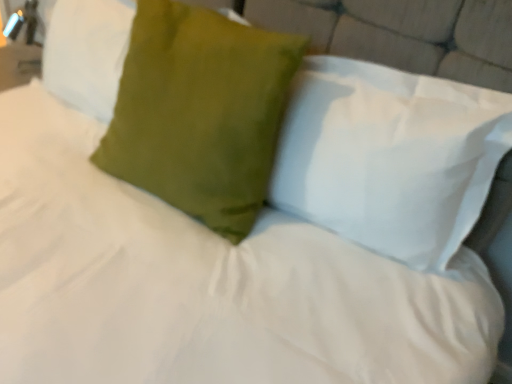
Question: From the image's perspective, is matte green pillow at upper center, the first pillow in the right-to-left sequence, above or below satin green pillow at center, which ranks as the second pillow in right-to-left order?

Choices:
 (A) below
 (B) above

Answer: (A)

Question: From a real-world perspective, relative to satin green pillow at center, the second pillow from the left, is matte green pillow at upper center, which appears as the third pillow when viewed from the left, vertically above or below?

Choices:
 (A) below
 (B) above

Answer: (B)

Question: Which is farther from the matte green pillow at upper center, the first pillow in the right-to-left sequence?

Choices:
 (A) satin green pillow at center, which ranks as the second pillow in right-to-left order
 (B) satin green pillow at upper left, the 1th pillow from the left

Answer: (B)

Question: Based on their relative distances, which object is nearer to the matte green pillow at upper center, which appears as the third pillow when viewed from the left?

Choices:
 (A) satin green pillow at upper left, which is the third pillow in right-to-left order
 (B) satin green pillow at center, the second pillow from the left

Answer: (B)